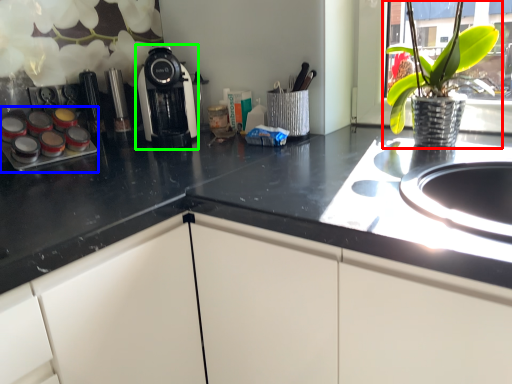
Question: Which object is positioned closest to houseplant (highlighted by a red box)? Select from appliance (highlighted by a blue box) and kitchen appliance (highlighted by a green box).

Choices:
 (A) appliance
 (B) kitchen appliance

Answer: (B)